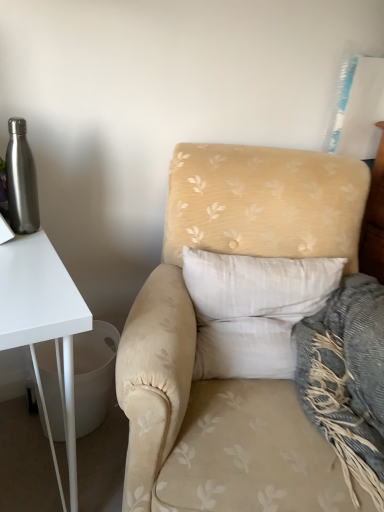
Question: Which is correct: beige floral fabric armchair at center is inside white soft pillow at center, or outside of it?

Choices:
 (A) outside
 (B) inside

Answer: (A)

Question: Considering the positions of beige floral fabric armchair at center and white soft pillow at center in the image, is beige floral fabric armchair at center wider or thinner than white soft pillow at center?

Choices:
 (A) thin
 (B) wide

Answer: (B)

Question: Which of these objects is positioned closest to the beige floral fabric armchair at center?

Choices:
 (A) brushed metal water bottle at left
 (B) white soft pillow at center

Answer: (B)

Question: Which object is the closest to the brushed metal water bottle at left?

Choices:
 (A) white soft pillow at center
 (B) beige floral fabric armchair at center

Answer: (B)